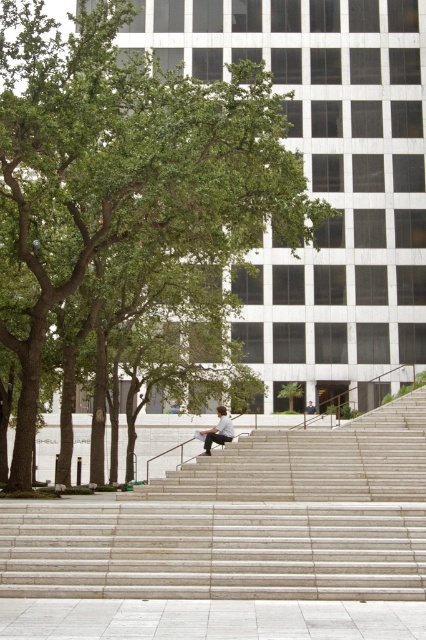
You are standing at the bottom of the staircase and want to place the light brown wooden skateboard at center near the green leafy tree at center. Considering the distance between them, can you reach the skateboard from where you are standing without moving closer?

The green leafy tree at center and light brown wooden skateboard at center are 21.09 feet apart. Since you are at the bottom of the staircase, you can reach the skateboard without moving closer as the distance is manageable for an average person to stretch or throw.

You are standing at the bottom of the smooth concrete stairs at center and want to reach the building entrance. The green leafy tree at center is blocking your view. Can you see the building entrance clearly?

The green leafy tree at center is above the smooth concrete stairs at center, so it is blocking the view of the building entrance. Therefore, you cannot see the building entrance clearly.

You are standing at the bottom of the staircase and want to see the building facade clearly. Which object is blocking your view more, the green leafy tree at center or the light brown wooden skateboard at center?

The green leafy tree at center is blocking your view more because it has a greater height compared to the light brown wooden skateboard at center.